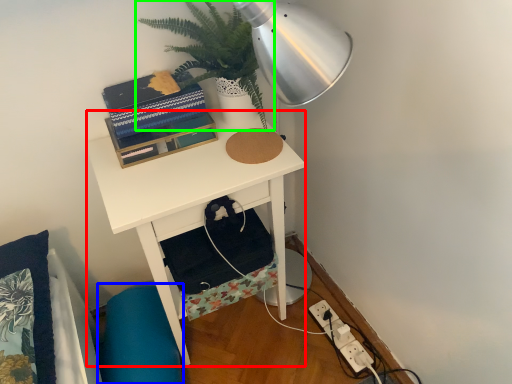
Question: Considering the real-world distances, which object is farthest from desk (highlighted by a red box)? swivel chair (highlighted by a blue box) or houseplant (highlighted by a green box)?

Choices:
 (A) swivel chair
 (B) houseplant

Answer: (A)